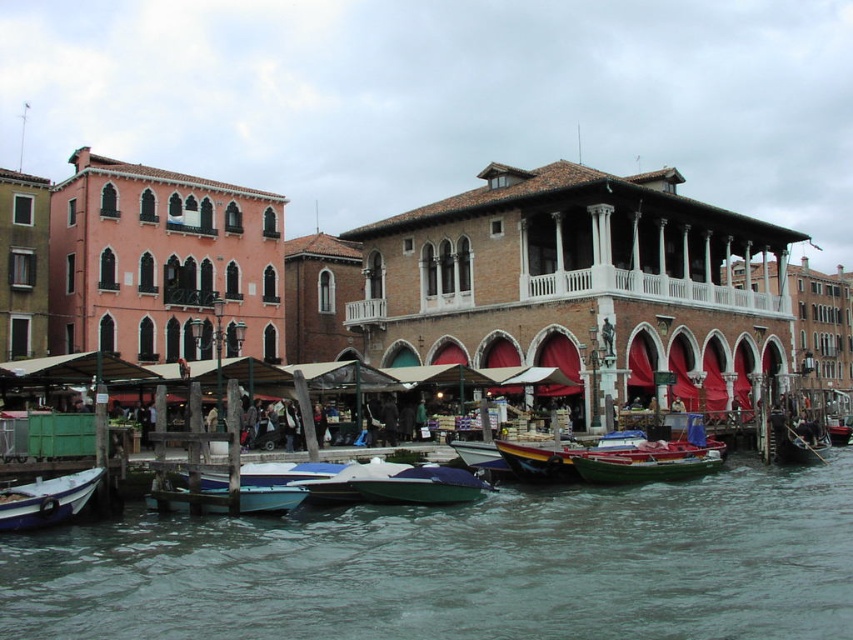
Looking at this image, you are standing at the edge of the canal in the historic market scene. You need to place a small floating platform exactly where the green water at lower center is located. What are the coordinates of the point where you should position the platform?

The coordinates for the green water at lower center are at point (463, 566), so you should position the platform there.

You are standing at the edge of the canal and want to take a photo of the green water at lower center and the green matte boat at lower left. Which object will appear larger in your photo?

The green water at lower center appears larger in the photo because it is closer to the viewer than the green matte boat at lower left.